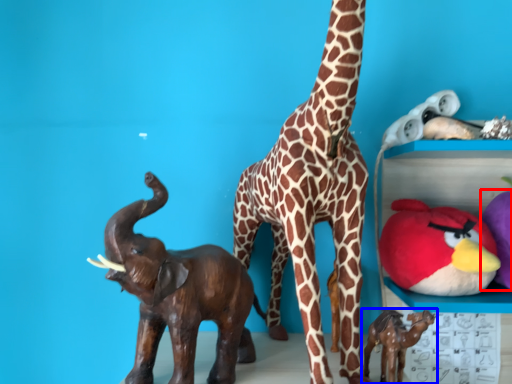
Question: Which object appears closest to the camera in this image, toy (highlighted by a red box) or toy (highlighted by a blue box)?

Choices:
 (A) toy
 (B) toy

Answer: (B)